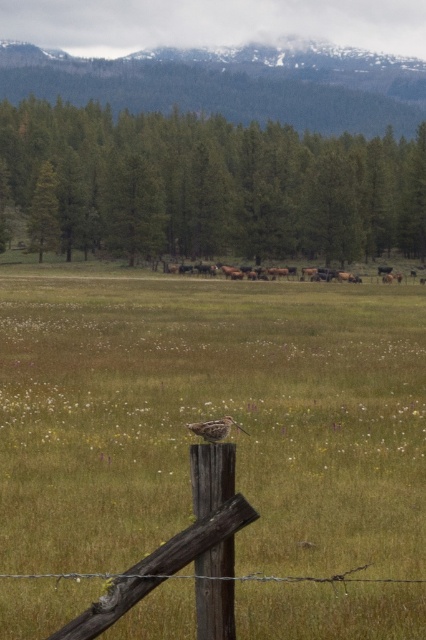
Question: From the image, what is the correct spatial relationship of weathered wood post at center in relation to brown speckled bird at center?

Choices:
 (A) left
 (B) right

Answer: (A)

Question: Is green matte tree at center above brown furry cows at center?

Choices:
 (A) no
 (B) yes

Answer: (B)

Question: Among these points, which one is nearest to the camera?

Choices:
 (A) (368, 500)
 (B) (370, 268)
 (C) (83, 237)

Answer: (A)

Question: Which of the following is the farthest from the observer?

Choices:
 (A) (302, 276)
 (B) (124, 177)

Answer: (B)

Question: Which object appears farthest from the camera in this image?

Choices:
 (A) brown speckled bird at center
 (B) brown furry cows at center

Answer: (B)

Question: Where is weathered wood post at center located in relation to green matte tree at center in the image?

Choices:
 (A) above
 (B) below

Answer: (B)